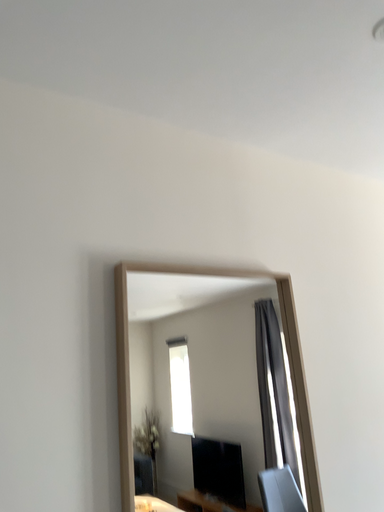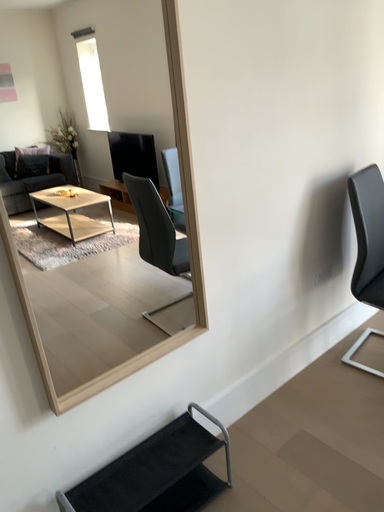
Question: How did the camera likely rotate when shooting the video?

Choices:
 (A) rotated downward
 (B) rotated upward

Answer: (A)